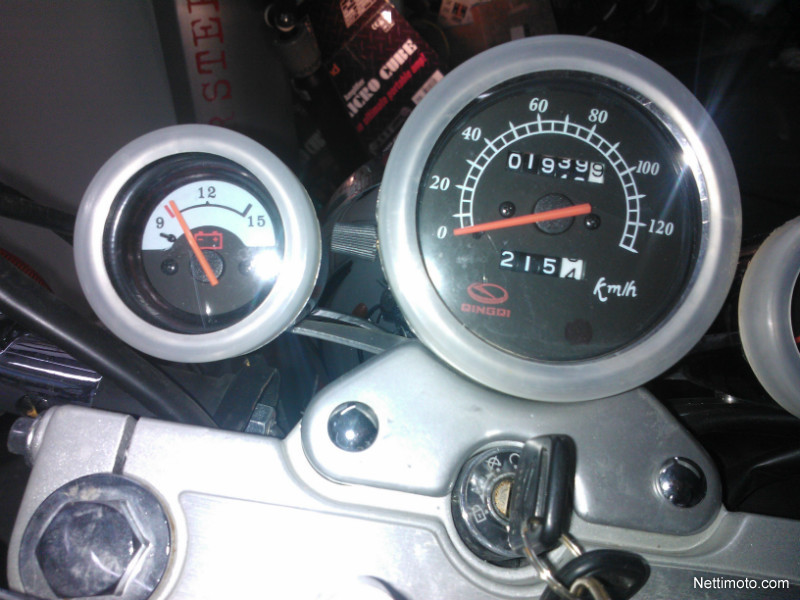
Identify the location of lock. Image resolution: width=800 pixels, height=600 pixels. (500, 492).